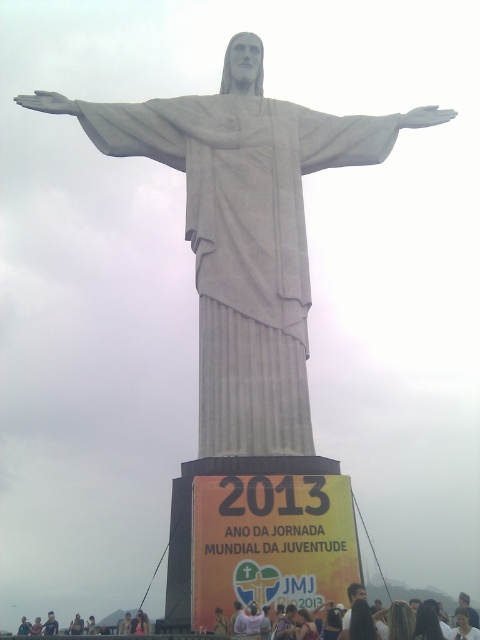
Which is more to the right, white marble statue at center or light brown hair at lower center?

Positioned to the right is white marble statue at center.

Between white marble statue at center and light brown hair at lower center, which one has more height?

With more height is white marble statue at center.

Is point (227, 394) positioned in front of point (50, 632)?

Yes, point (227, 394) is closer to viewer.

Find the location of `white marble statue at center`. white marble statue at center is located at coordinates (244, 232).

Is point (52, 611) positioned behind point (27, 621)?

No, (52, 611) is in front of (27, 621).

Can you confirm if light brown hair at lower center is positioned to the right of light brown hair at lower left?

Yes, light brown hair at lower center is to the right of light brown hair at lower left.

Is point (48, 620) farther from viewer compared to point (21, 620)?

That is False.

Locate an element on the screen. light brown hair at lower center is located at coordinates (49, 625).

Does white marble statue at center appear on the right side of light brown hair at lower left?

Yes, white marble statue at center is to the right of light brown hair at lower left.

Can you confirm if white marble statue at center is positioned below light brown hair at lower left?

Incorrect, white marble statue at center is not positioned below light brown hair at lower left.

What do you see at coordinates (244, 232) in the screenshot?
I see `white marble statue at center` at bounding box center [244, 232].

The image size is (480, 640). I want to click on white marble statue at center, so click(x=244, y=232).